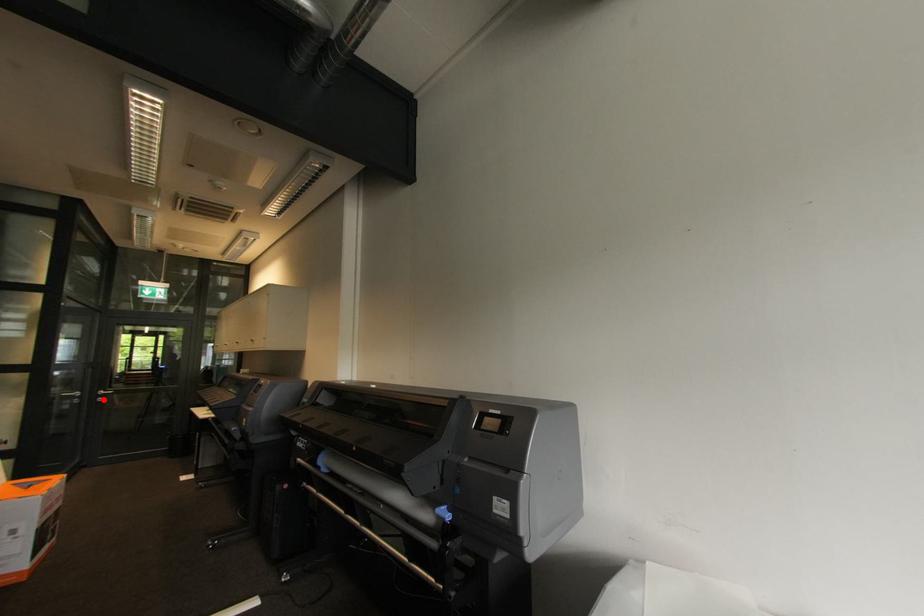
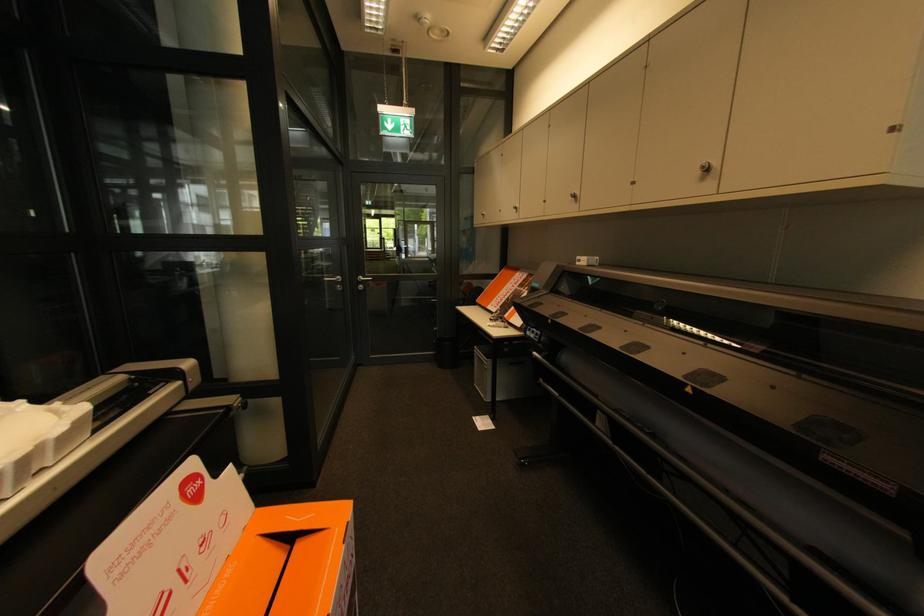
Question: I am providing you with two images of the same scene from different viewpoints. Image1 has a red point marked. In image2, the corresponding 3D location appears at what relative position? Reply with the corresponding letter.

Choices:
 (A) Closer
 (B) Farther

Answer: (A)